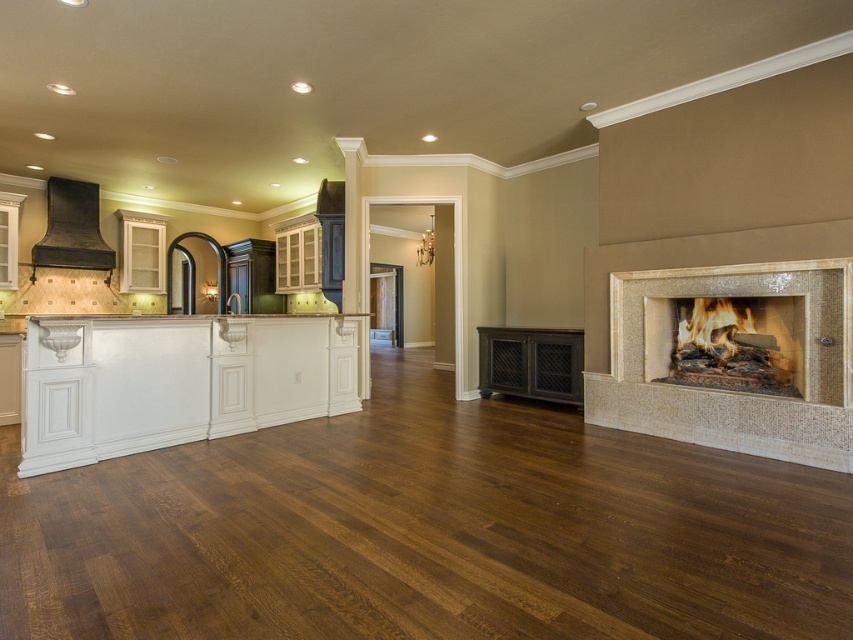
You are a guest standing in the living room and notice the matte stone fireplace at right and the matte black range hood at upper left. Which object is located closer to the ceiling?

The matte black range hood at upper left is closer to the ceiling since it is positioned above the matte stone fireplace at right.

You are an interior designer assessing the living room layout. You need to place a floor lamp between the beige mosaic tile fireplace at right and the matte stone fireplace at right. Which fireplace should the lamp be closer to to maintain balance in the room?

The beige mosaic tile fireplace at right is much taller than the matte stone fireplace at right, so placing the floor lamp closer to the shorter matte stone fireplace at right would help balance the visual weight in the room.